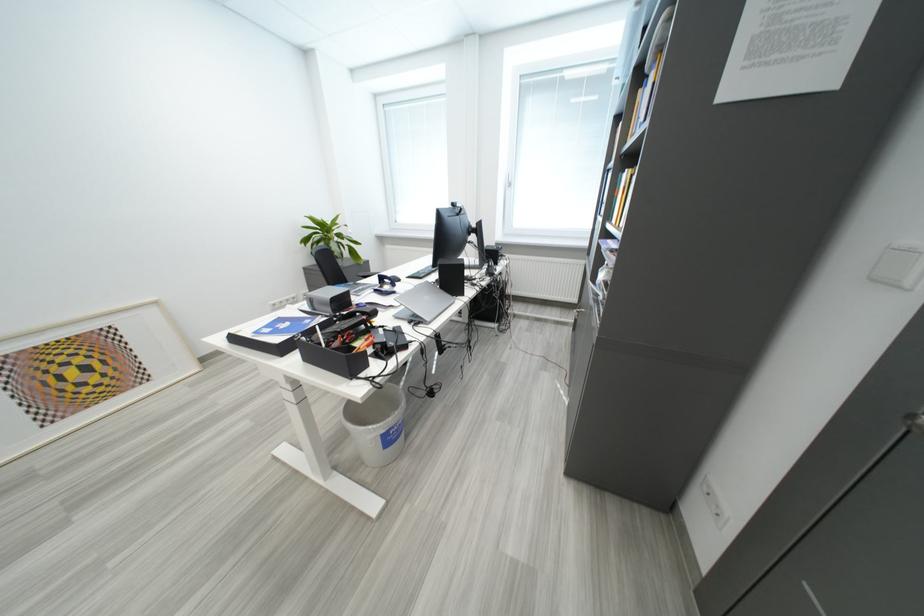
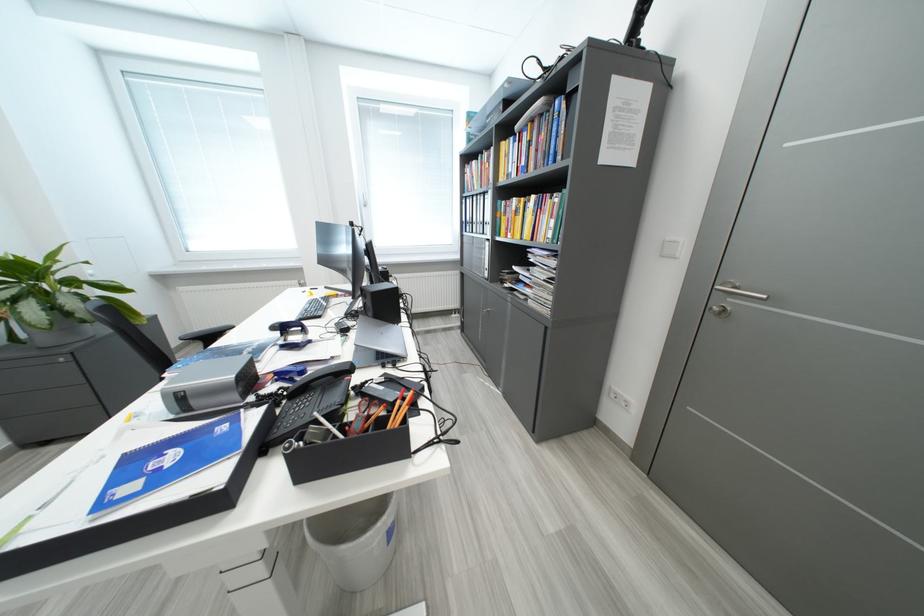
Question: How did the camera likely rotate?

Choices:
 (A) Left
 (B) Right
 (C) Up
 (D) Down

Answer: (B)